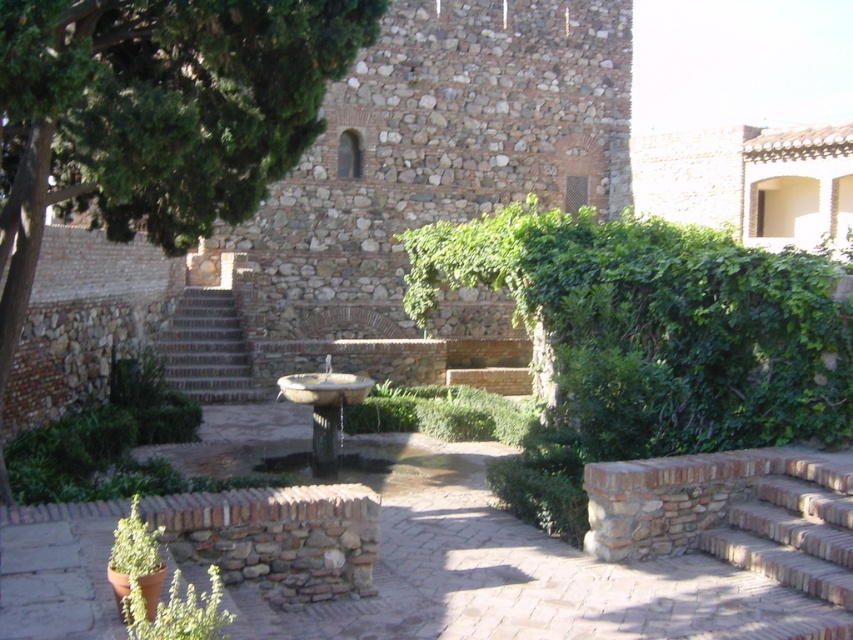
Question: Which of the following is the closest to the observer?

Choices:
 (A) (314, 424)
 (B) (167, 10)
 (C) (163, 372)

Answer: (B)

Question: Is green leafy tree at upper left bigger than brown stone stairs at center?

Choices:
 (A) no
 (B) yes

Answer: (A)

Question: Based on their relative distances, which object is nearer to the brown stone stairs at center?

Choices:
 (A) brick/stone stairs at lower right
 (B) stone fountain at center

Answer: (B)

Question: Can you confirm if green leafy tree at upper left is wider than green leafy ivy at center?

Choices:
 (A) yes
 (B) no

Answer: (B)

Question: Which object is the farthest from the brick/stone stairs at lower right?

Choices:
 (A) stone fountain at center
 (B) green leafy tree at upper left
 (C) brown stone stairs at center

Answer: (C)

Question: Is brick/stone stairs at lower right to the left of stone fountain at center from the viewer's perspective?

Choices:
 (A) yes
 (B) no

Answer: (B)